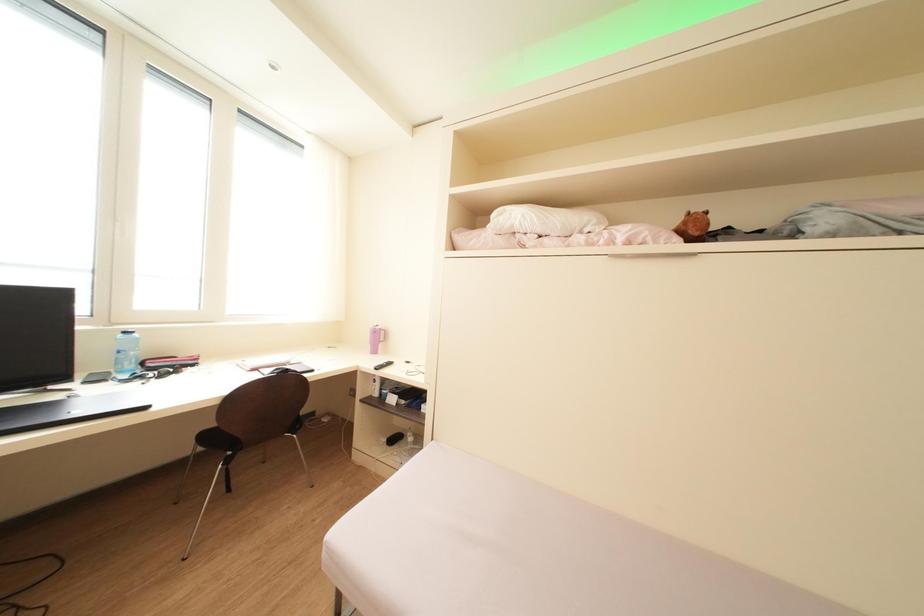
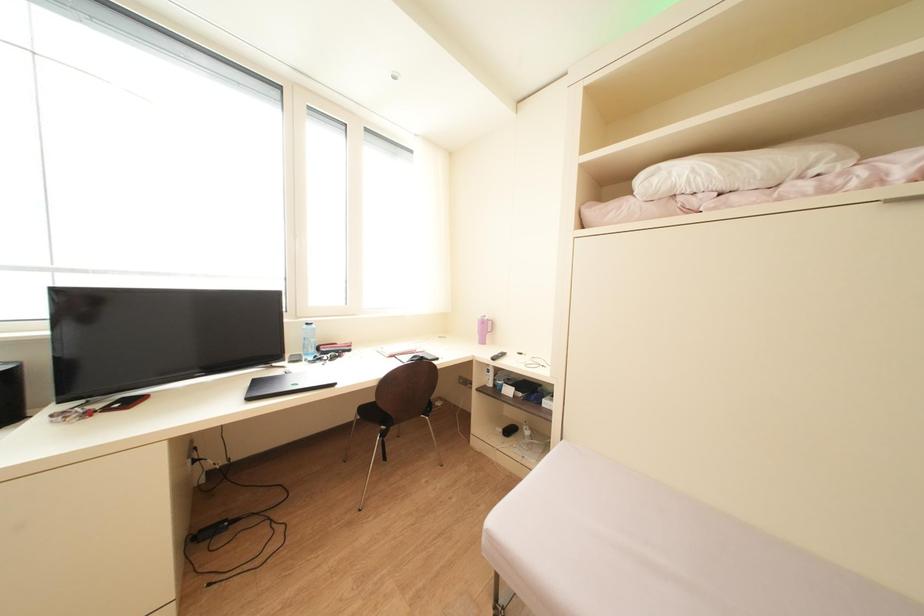
Question: The camera is either moving clockwise (left) or counter-clockwise (right) around the object. The first image is from the beginning of the video and the second image is from the end. Is the camera moving left or right when shooting the video?

Choices:
 (A) Left
 (B) Right

Answer: (B)